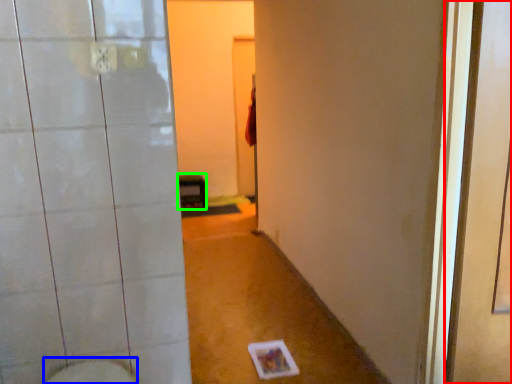
Question: Which is nearer to the screen door (highlighted by a red box)? bidet (highlighted by a blue box) or furniture (highlighted by a green box).

Choices:
 (A) bidet
 (B) furniture

Answer: (A)